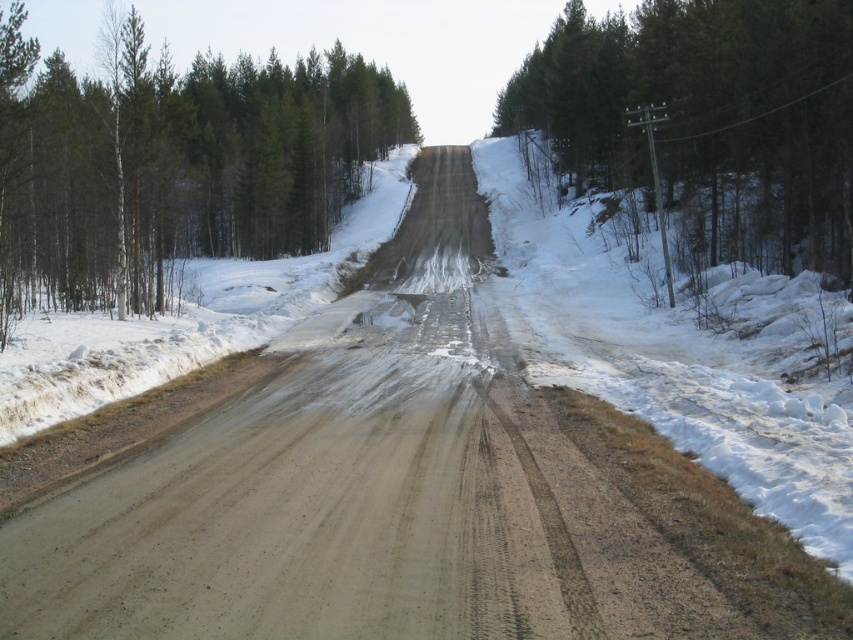
You are a hiker trying to determine which tree is taller between the green matte tree at upper left and the green textured tree at right. Based on the scene, which one is taller?

The green matte tree at upper left is taller than the green textured tree at right.

You are a hiker trying to navigate through this winter scene. You see the green matte tree at upper left and the green textured tree at right. Which tree would you choose to walk towards if you want to reach the nearest tree first?

The green matte tree at upper left is closer to the viewer than the green textured tree at right, so you should walk towards the green matte tree at upper left to reach the nearest tree first.

You are a hiker trying to navigate the snowy road. You see the green matte tree at upper left and the green textured tree at right. Which tree is closer to the road?

The green textured tree at right is closer to the road because the green matte tree at upper left is positioned over it, meaning it is further away.